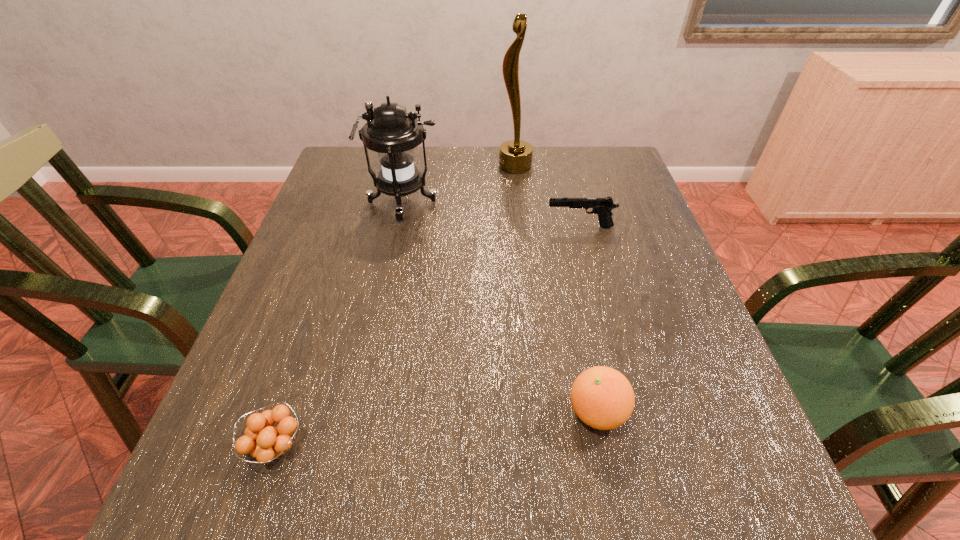
At what (x,y) coordinates should I click in order to perform the action: click on vacant space located on the front of the fourth shortest object. Please return your answer as a coordinate pair (x, y). The image size is (960, 540). Looking at the image, I should click on (376, 336).

Locate an element on the screen. vacant area situated on the front of the taller orange fruit is located at coordinates (614, 500).

Identify the location of blank area located at the aiming end of the gun. (483, 227).

Where is `vacant space located at the aiming end of the gun`? This screenshot has height=540, width=960. vacant space located at the aiming end of the gun is located at coordinates (479, 227).

This screenshot has height=540, width=960. I want to click on vacant space located 0.190m at the aiming end of the gun, so click(x=470, y=227).

Locate an element on the screen. Image resolution: width=960 pixels, height=540 pixels. vacant area situated on the right of the shorter orange fruit is located at coordinates (412, 447).

Find the location of `award that is positioned at the far edge`. award that is positioned at the far edge is located at coordinates (515, 156).

The image size is (960, 540). I want to click on lantern at the far edge, so click(390, 131).

Identify the location of object at the near edge. This screenshot has width=960, height=540. (265, 444).

The image size is (960, 540). What are the coordinates of `lantern located in the left edge section of the desktop` in the screenshot? It's located at (390, 131).